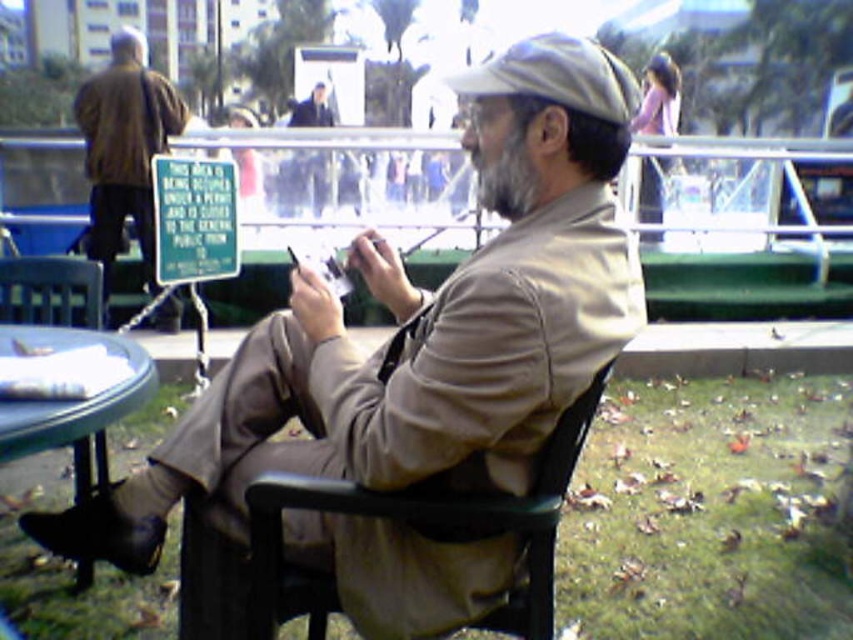
Is point (349, 595) positioned in front of point (405, 499)?

No, (349, 595) is further to viewer.

Who is positioned more to the right, matte khaki jacket at center or black plastic chair at center?

From the viewer's perspective, black plastic chair at center appears more on the right side.

At what (x,y) coordinates should I click in order to perform the action: click on matte khaki jacket at center. Please return your answer as a coordinate pair (x, y). This screenshot has height=640, width=853. Looking at the image, I should click on (422, 328).

Which of these two, black plastic chair at center or green plastic table at lower left, stands shorter?

Standing shorter between the two is green plastic table at lower left.

Is point (514, 625) in front of point (44, 422)?

No, (514, 625) is further to viewer.

The height and width of the screenshot is (640, 853). I want to click on black plastic chair at center, so click(x=426, y=531).

Can you confirm if matte khaki jacket at center is bigger than green plastic table at lower left?

Yes.

Between point (424, 355) and point (80, 387), which one is positioned in front?

Point (424, 355) is more forward.

Is point (437, 545) positioned before point (32, 364)?

Yes.

Find the location of `matte khaki jacket at center`. matte khaki jacket at center is located at coordinates (422, 328).